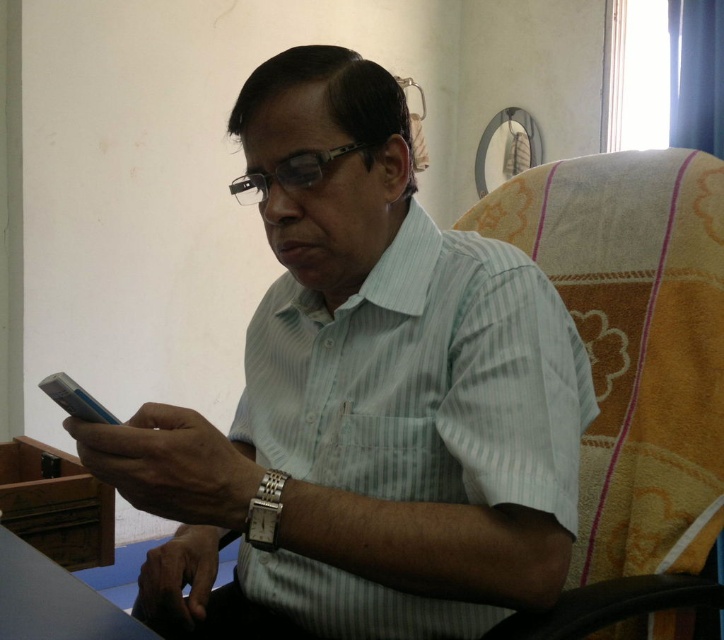
Question: Which of the following is the farthest from the observer?

Choices:
 (A) (138, 636)
 (B) (660, 193)
 (C) (277, 228)

Answer: (B)

Question: Is white striped shirt at center closer to camera compared to smooth wooden table at lower left?

Choices:
 (A) yes
 (B) no

Answer: (B)

Question: In this image, where is white striped shirt at center located relative to smooth wooden table at lower left?

Choices:
 (A) right
 (B) left

Answer: (A)

Question: Is beige fabric swivel chair at right further to camera compared to smooth wooden table at lower left?

Choices:
 (A) no
 (B) yes

Answer: (B)

Question: Among these objects, which one is nearest to the camera?

Choices:
 (A) white striped shirt at center
 (B) beige fabric swivel chair at right
 (C) smooth wooden table at lower left

Answer: (C)

Question: Which of the following is the farthest from the observer?

Choices:
 (A) white striped shirt at center
 (B) smooth wooden table at lower left
 (C) beige fabric swivel chair at right

Answer: (C)